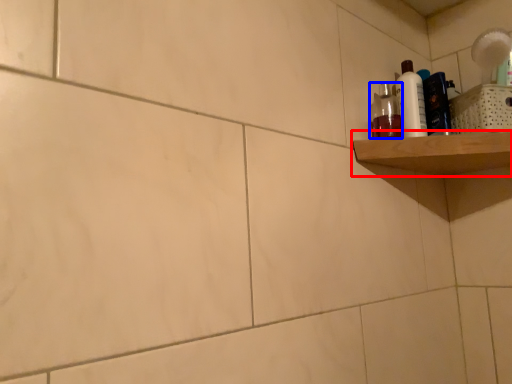
Question: Which of the following is the farthest to the observer, shelf (highlighted by a red box) or mouthwash (highlighted by a blue box)?

Choices:
 (A) shelf
 (B) mouthwash

Answer: (B)